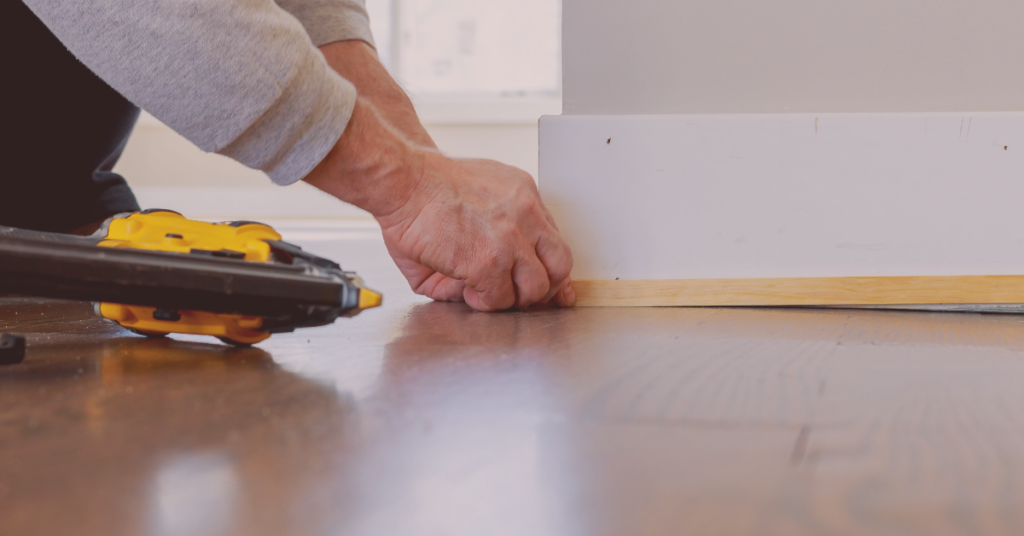
You are a GUI agent. You are given a task and a screenshot of the screen. Output one action in this format:
    pyautogui.click(x=<x>, y=<y>)
    Task: Click on the wooden floor
    The image size is (1024, 536).
    Given the screenshot: What is the action you would take?
    pyautogui.click(x=717, y=419)